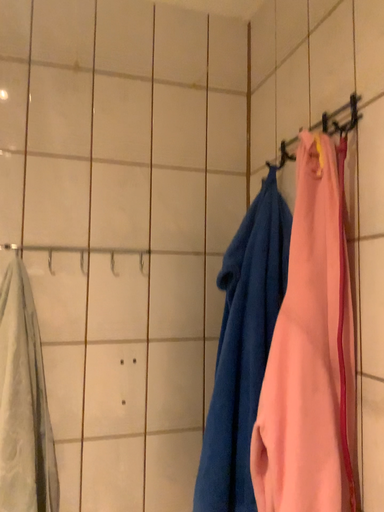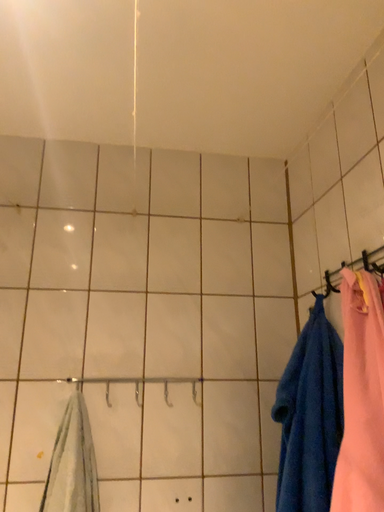
Question: How did the camera likely rotate when shooting the video?

Choices:
 (A) rotated left
 (B) rotated right

Answer: (A)